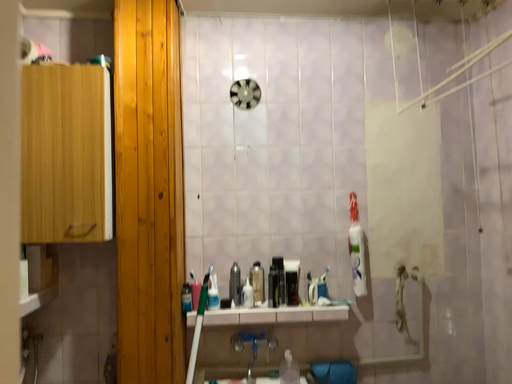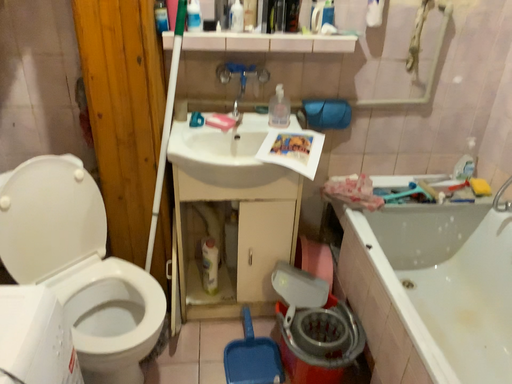
Question: How did the camera likely rotate when shooting the video?

Choices:
 (A) rotated upward
 (B) rotated downward

Answer: (B)